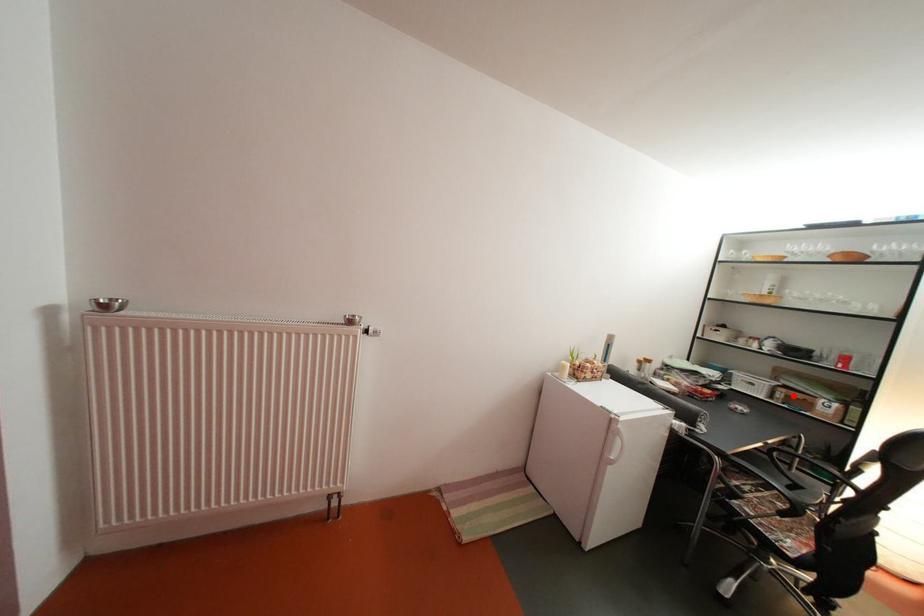
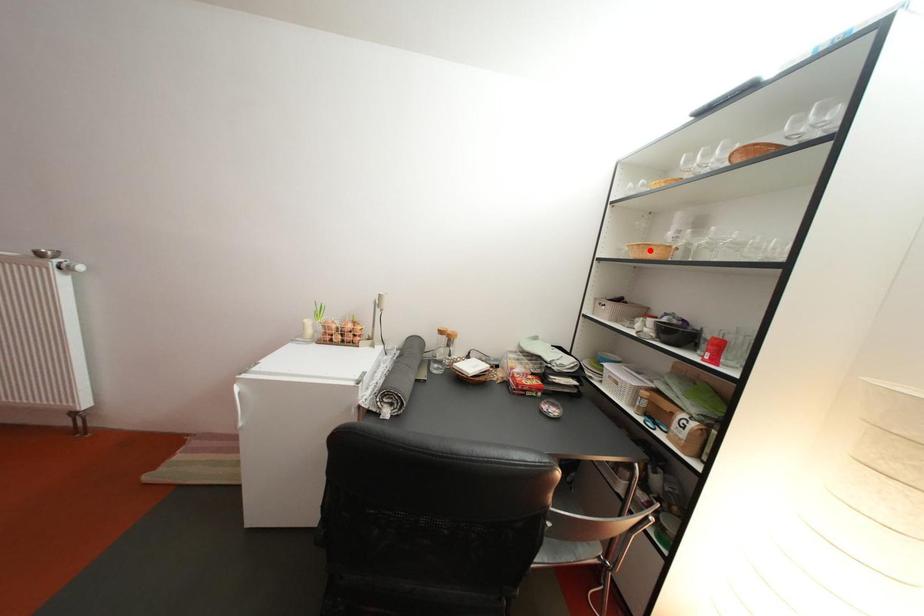
I am providing you with two images of the same scene from different viewpoints. A red point is marked on the first image and another point is marked on the second image. Do the highlighted points in image1 and image2 indicate the same real-world spot?

No